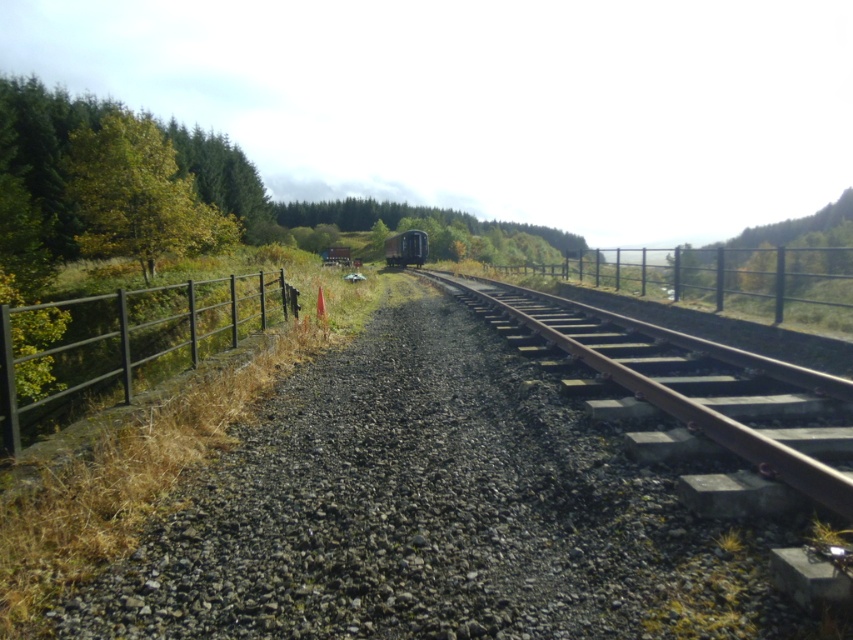
The image size is (853, 640). What do you see at coordinates (730, 280) in the screenshot? I see `metallic fence at right` at bounding box center [730, 280].

Image resolution: width=853 pixels, height=640 pixels. What do you see at coordinates (730, 280) in the screenshot? I see `metallic fence at right` at bounding box center [730, 280].

Identify the location of metallic fence at right. The image size is (853, 640). (730, 280).

Consider the image. Does rusty metal train track at center have a larger size compared to metallic fence at right?

Actually, rusty metal train track at center might be smaller than metallic fence at right.

Identify the location of rusty metal train track at center. This screenshot has height=640, width=853. (688, 388).

The height and width of the screenshot is (640, 853). Find the location of `rusty metal train track at center`. rusty metal train track at center is located at coordinates (688, 388).

Who is shorter, green leafy tree at left or green matte tree at center?

With less height is green matte tree at center.

Does green leafy tree at left lie in front of green matte tree at center?

That is True.

This screenshot has width=853, height=640. What do you see at coordinates (45, 147) in the screenshot?
I see `green leafy tree at left` at bounding box center [45, 147].

You are a GUI agent. You are given a task and a screenshot of the screen. Output one action in this format:
    pyautogui.click(x=<x>, y=<y>)
    Task: Click on the green leafy tree at left
    The width and height of the screenshot is (853, 640).
    Given the screenshot: What is the action you would take?
    pyautogui.click(x=45, y=147)